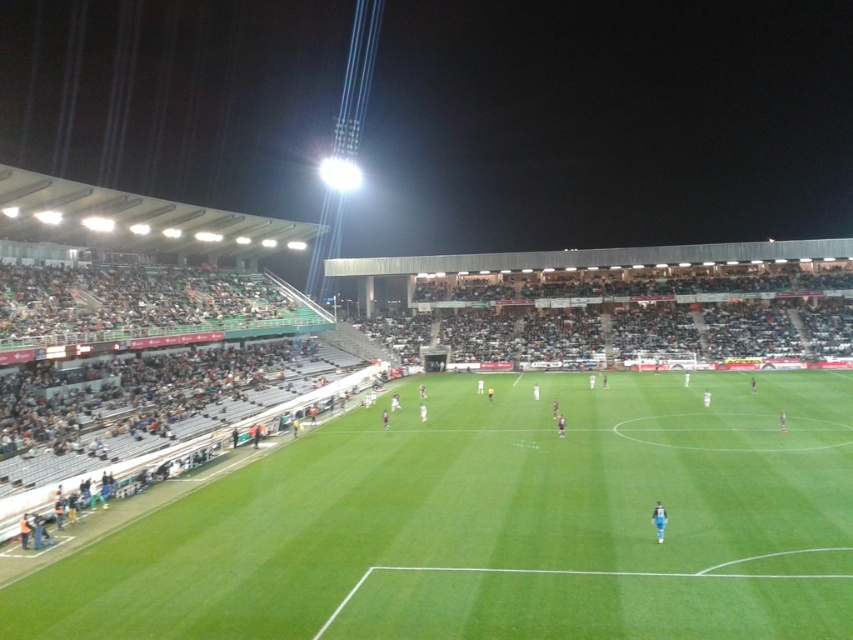
Question: Is green grass football field at center closer to camera compared to blue fabric person at center?

Choices:
 (A) no
 (B) yes

Answer: (B)

Question: Which of the following is the closest to the observer?

Choices:
 (A) blue fabric person at center
 (B) green grass football field at center

Answer: (B)

Question: Among these objects, which one is farthest from the camera?

Choices:
 (A) green grass football field at center
 (B) blue fabric person at center

Answer: (B)

Question: Does green grass football field at center appear over blue fabric person at center?

Choices:
 (A) yes
 (B) no

Answer: (B)

Question: Does green grass football field at center appear on the right side of blue fabric person at center?

Choices:
 (A) no
 (B) yes

Answer: (B)